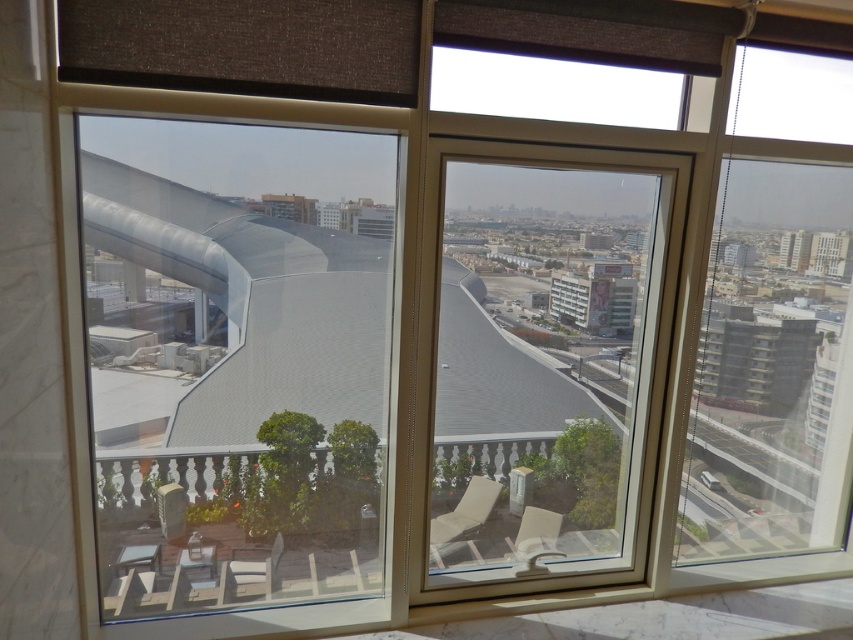
Question: Which point appears closest to the camera in this image?

Choices:
 (A) (256, 589)
 (B) (527, 536)

Answer: (A)

Question: Observing the image, what is the correct spatial positioning of matte white chair at center in reference to matte beige chair at lower right?

Choices:
 (A) left
 (B) right

Answer: (A)

Question: Where is matte white chair at center located in relation to matte beige chair at lower right in the image?

Choices:
 (A) above
 (B) below

Answer: (B)

Question: Is matte white chair at center above matte beige chair at lower right?

Choices:
 (A) yes
 (B) no

Answer: (B)

Question: Estimate the real-world distances between objects in this image. Which object is closer to the matte white lounge chair at center?

Choices:
 (A) matte beige chair at lower right
 (B) matte white chair at center

Answer: (A)

Question: Which of these objects is positioned farthest from the matte white chair at center?

Choices:
 (A) matte white lounge chair at center
 (B) matte beige chair at lower right

Answer: (B)